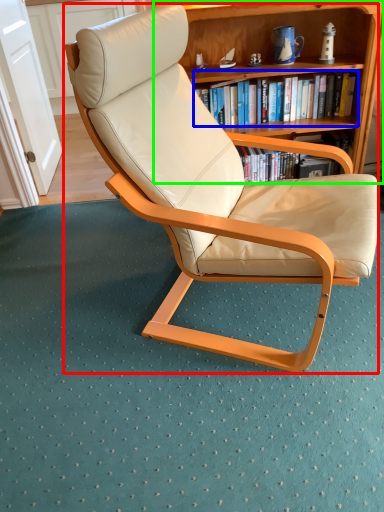
Question: Based on their relative distances, which object is nearer to chair (highlighted by a red box)? Choose from book (highlighted by a blue box) and bookcase (highlighted by a green box).

Choices:
 (A) book
 (B) bookcase

Answer: (B)